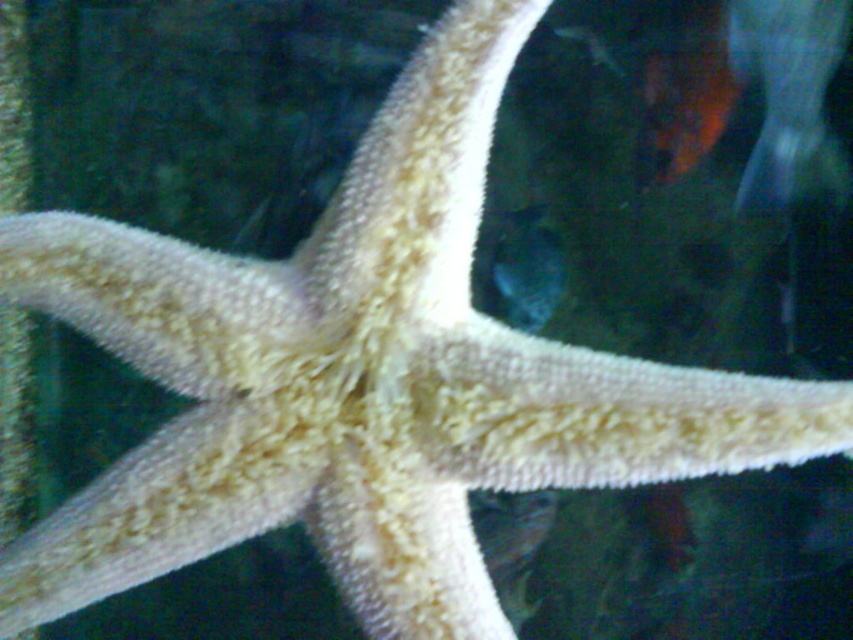
You are a marine biologist examining the starfish through a camera lens. You notice two points marked on the starfish, one at point (682,125) and another at point (621,76). Which point is closer to the camera lens?

Point (621,76) is closer to the camera lens because the description states that point (682,125) is behind point (621,76).

You are an underwater photographer aiming to capture a closeup of the orange matte goldfish at upper right and the shiny silver fish at upper center. Which fish should you focus on if you want to ensure both are in the frame without moving the camera?

The orange matte goldfish at upper right has a greater height compared to the shiny silver fish at upper center, so focusing on the taller orange matte goldfish at upper right would ensure both are in the frame without needing to adjust the camera position.

You are a diver exploring an underwater scene. You see an orange matte goldfish at upper right and a shiny silver fish at upper center. Which fish is closer to you?

The orange matte goldfish at upper right is closer to you because it is in front of the shiny silver fish at upper center.